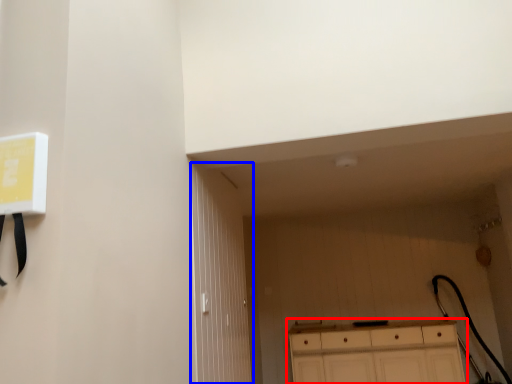
Question: Among these objects, which one is nearest to the camera, cabinetry (highlighted by a red box) or door (highlighted by a blue box)?

Choices:
 (A) cabinetry
 (B) door

Answer: (B)